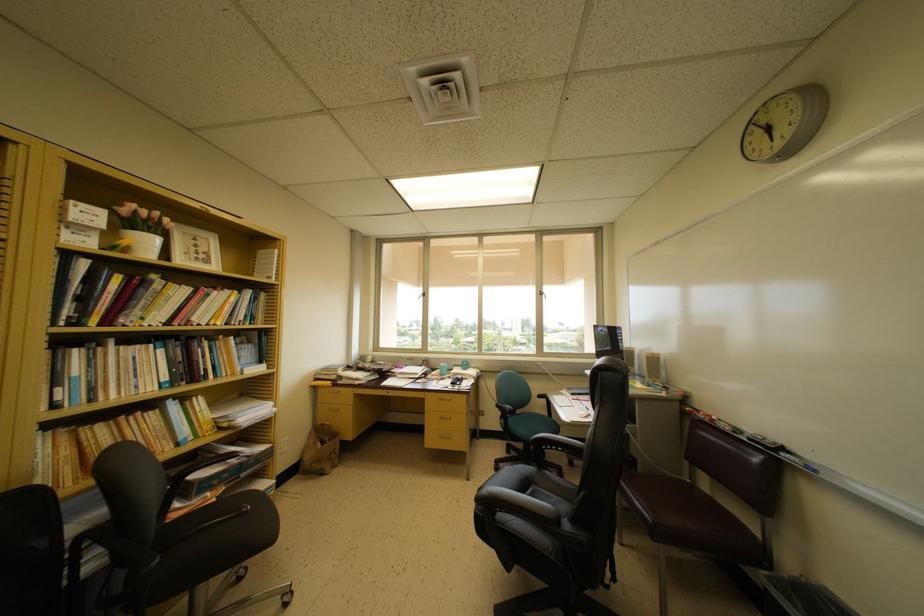
In order to click on whiteboard marker in this screenshot , I will do `click(796, 460)`.